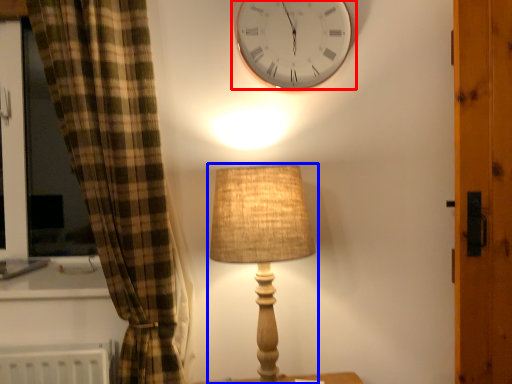
Question: Which point is further to the camera, wall clock (highlighted by a red box) or lamp (highlighted by a blue box)?

Choices:
 (A) wall clock
 (B) lamp

Answer: (A)